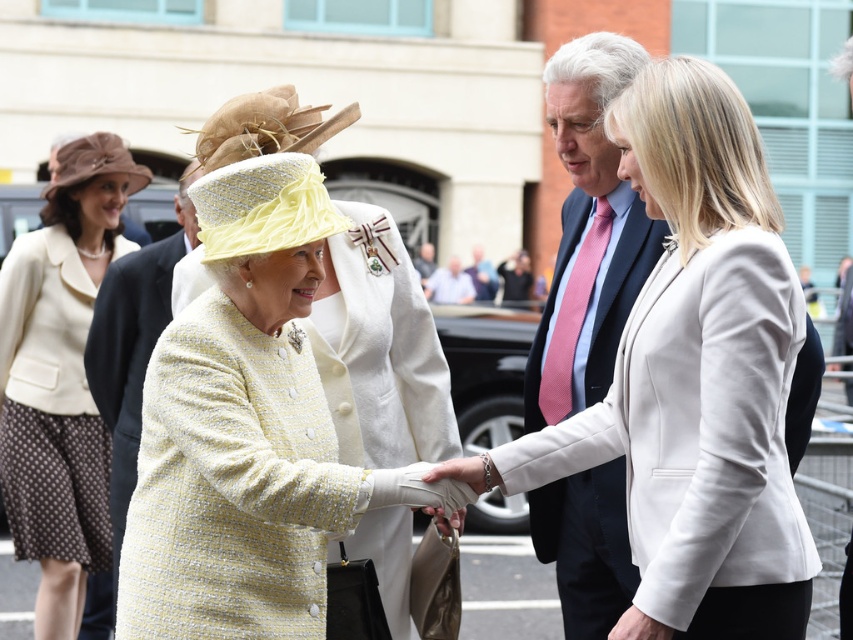
Question: Which object is farther from the camera taking this photo?

Choices:
 (A) dark blue suit at center
 (B) yellow tweed coat at center

Answer: (A)

Question: Which point appears farthest from the camera in this image?

Choices:
 (A) (83, 173)
 (B) (589, 131)
 (C) (39, 312)
 (D) (251, 172)

Answer: (A)

Question: Does matte cream blazer at left have a lesser width compared to brown felt hat at upper left?

Choices:
 (A) no
 (B) yes

Answer: (B)

Question: Which point is farther from the camera taking this photo?

Choices:
 (A) (56, 186)
 (B) (282, 129)
 (C) (728, 252)
 (D) (279, 172)

Answer: (A)

Question: In this image, where is light beige fabric jacket at center located relative to light beige wool coat at left?

Choices:
 (A) left
 (B) right

Answer: (B)

Question: Does dark blue suit at center appear over light blue shirt at center?

Choices:
 (A) yes
 (B) no

Answer: (B)